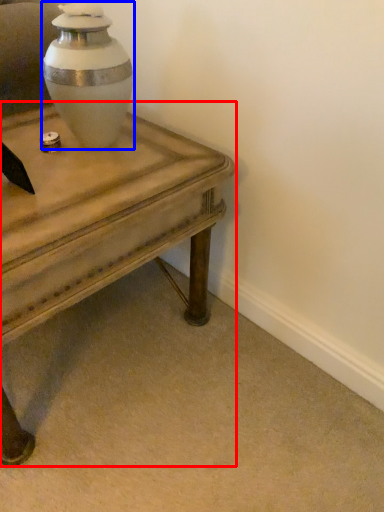
Question: Which object appears closest to the camera in this image, table (highlighted by a red box) or vase (highlighted by a blue box)?

Choices:
 (A) table
 (B) vase

Answer: (A)